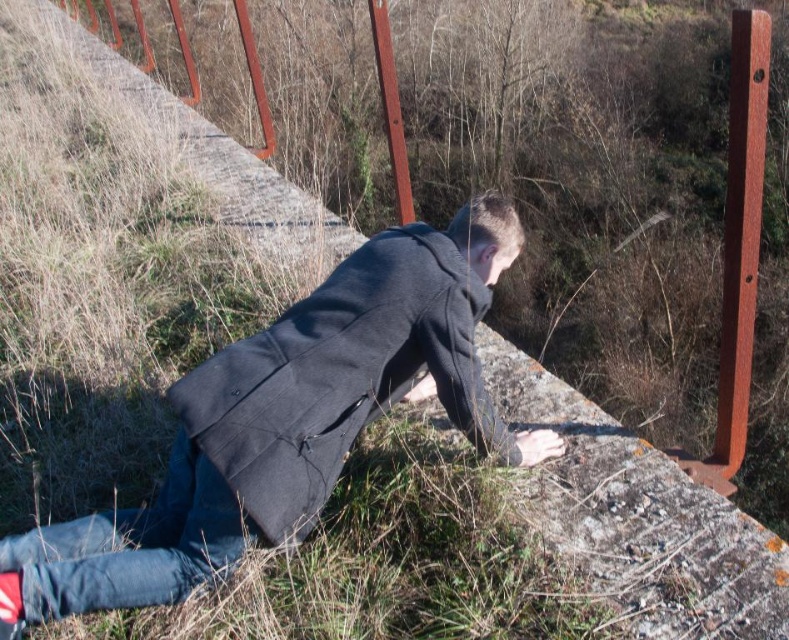
Question: Is dark gray matte sweatshirt at center above rusty metal pole at upper center?

Choices:
 (A) yes
 (B) no

Answer: (B)

Question: In this image, where is dark gray matte sweatshirt at center located relative to rusty metal pole at right?

Choices:
 (A) left
 (B) right

Answer: (A)

Question: Which object is closer to the camera taking this photo?

Choices:
 (A) rusty metal pole at right
 (B) dark gray matte sweatshirt at center
 (C) rusty metal pole at upper center

Answer: (B)

Question: Is dark gray matte sweatshirt at center above rusty metal pole at upper center?

Choices:
 (A) no
 (B) yes

Answer: (A)

Question: Based on their relative distances, which object is nearer to the rusty metal pole at upper center?

Choices:
 (A) dark gray matte sweatshirt at center
 (B) rusty metal pole at right

Answer: (A)

Question: Which of these objects is positioned farthest from the rusty metal pole at upper center?

Choices:
 (A) rusty metal pole at right
 (B) dark gray matte sweatshirt at center

Answer: (A)